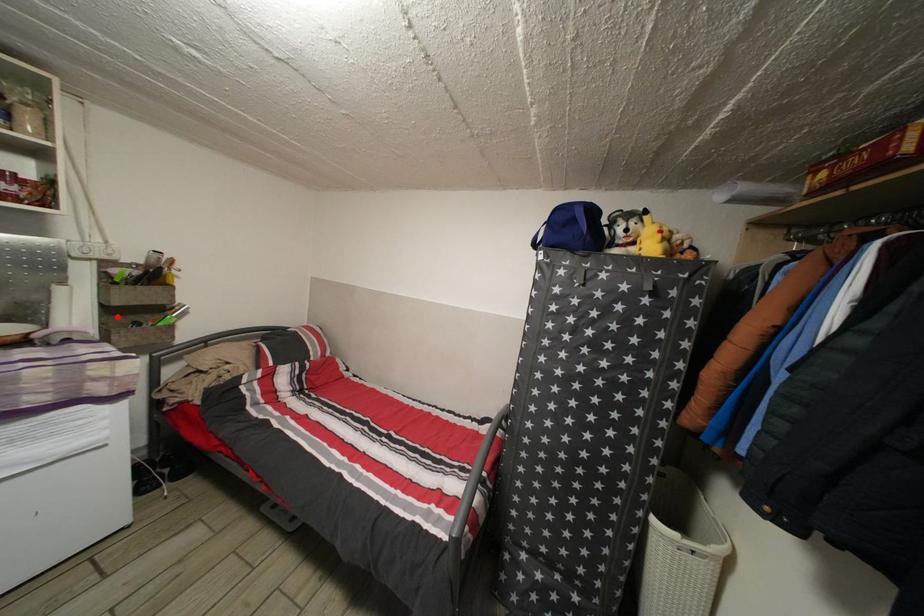
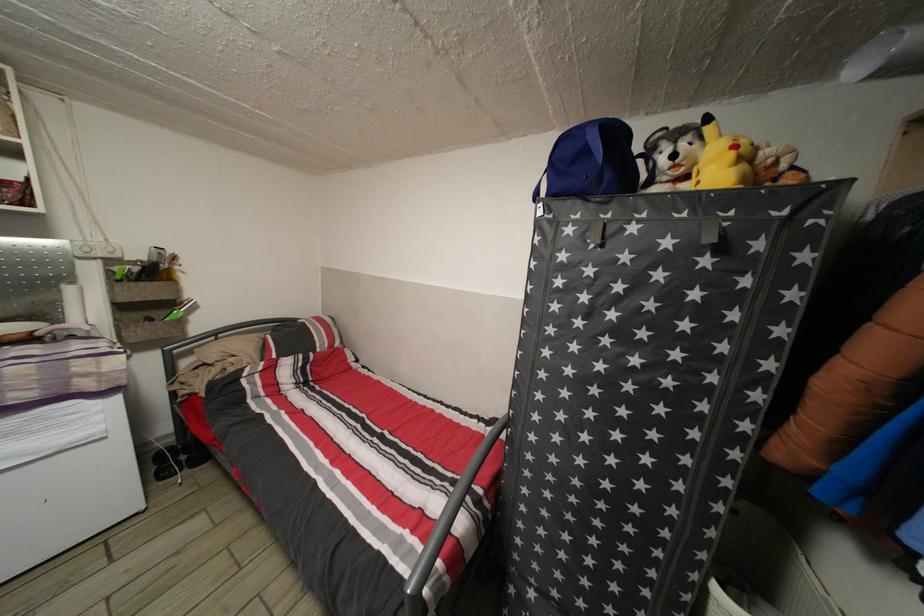
In the second image, find the point that corresponds to the highlighted location in the first image.

(128, 314)